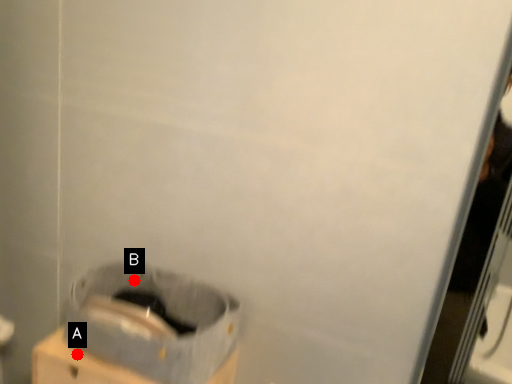
Question: Two points are circled on the image, labeled by A and B beside each circle. Among these points, which one is farthest from the camera?

Choices:
 (A) A is further
 (B) B is further

Answer: (B)